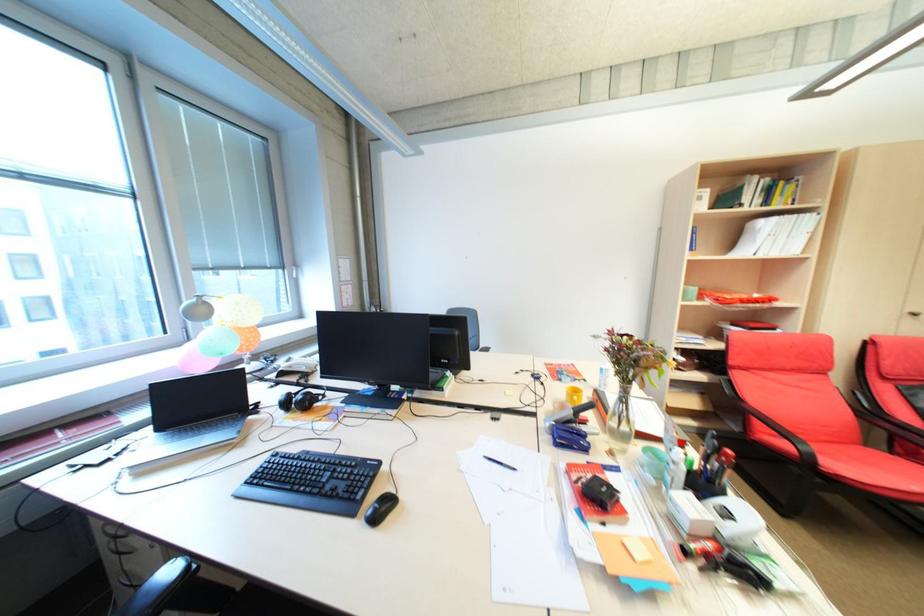
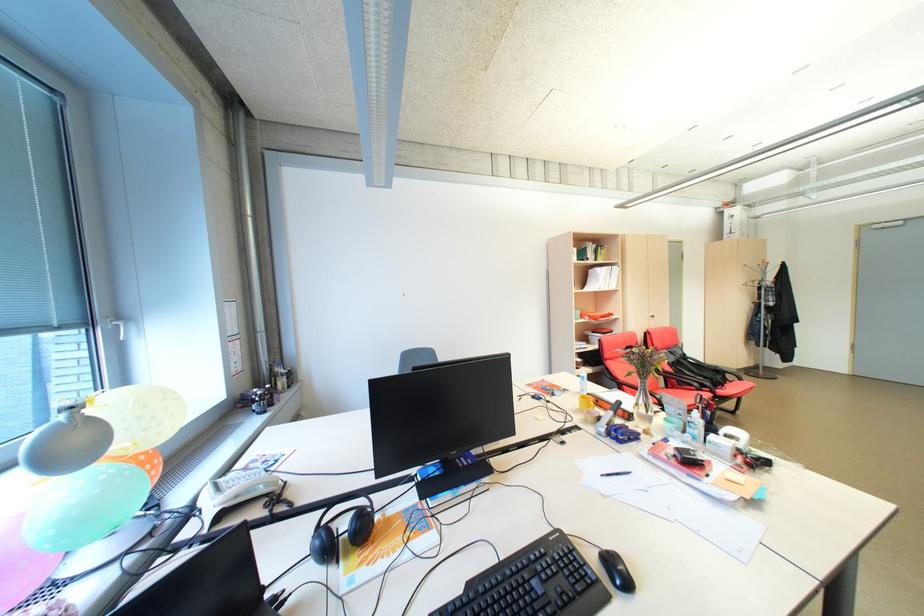
The point at the highlighted location is marked in the first image. Where is the corresponding point in the second image?

(688, 410)